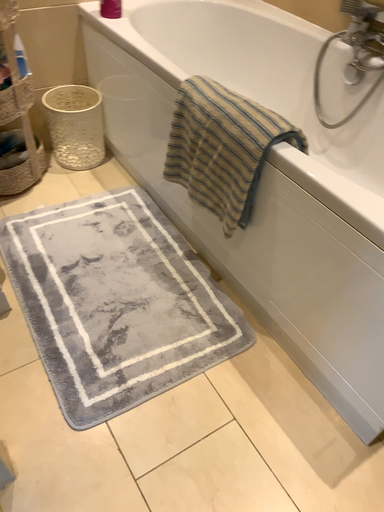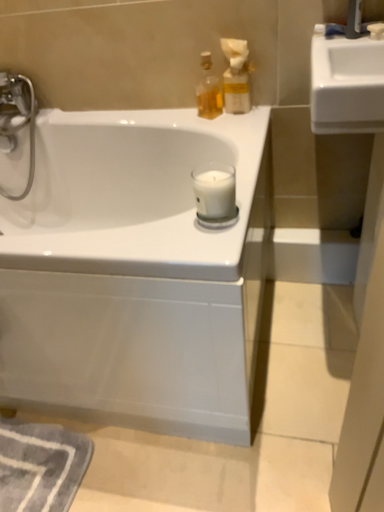
Question: Which way did the camera rotate in the video?

Choices:
 (A) rotated upward
 (B) rotated downward

Answer: (A)